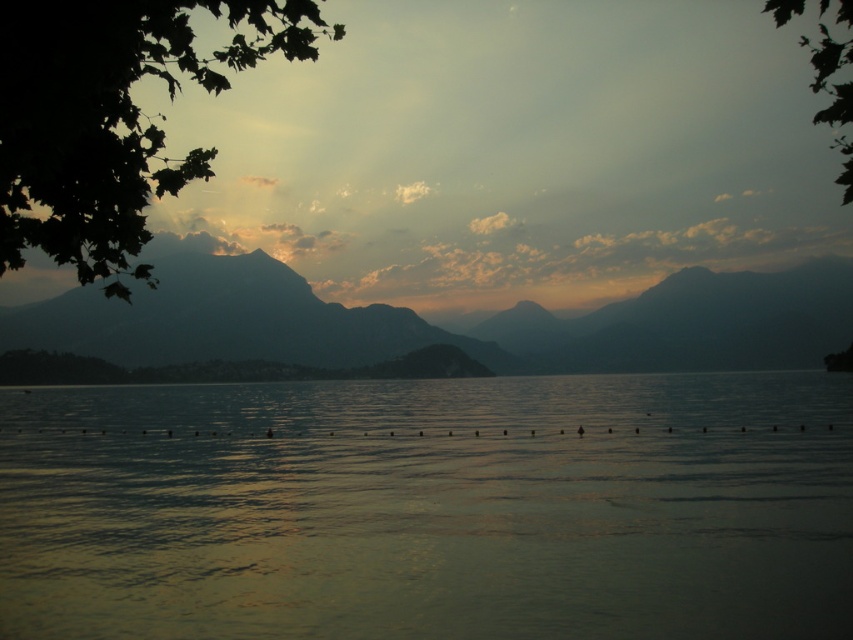
Who is taller, smokey gray mountain at upper left or green leafy tree at upper right?

Standing taller between the two is green leafy tree at upper right.

Does smokey gray mountain at upper left lie behind green leafy tree at upper right?

That is True.

Who is more distant from viewer, (717, 353) or (830, 93)?

The point (717, 353) is behind.

Identify the location of smokey gray mountain at upper left. (442, 328).

Based on the photo, does silvery reflective water at center have a greater width compared to smokey gray mountain at upper left?

No, silvery reflective water at center is not wider than smokey gray mountain at upper left.

Locate an element on the screen. Image resolution: width=853 pixels, height=640 pixels. silvery reflective water at center is located at coordinates (430, 508).

The width and height of the screenshot is (853, 640). Find the location of `silvery reflective water at center`. silvery reflective water at center is located at coordinates (430, 508).

Does smokey gray mountain at upper left appear on the right side of green leafy tree at upper left?

Correct, you'll find smokey gray mountain at upper left to the right of green leafy tree at upper left.

Locate an element on the screen. This screenshot has height=640, width=853. smokey gray mountain at upper left is located at coordinates (442, 328).

Locate an element on the screen. smokey gray mountain at upper left is located at coordinates (442, 328).